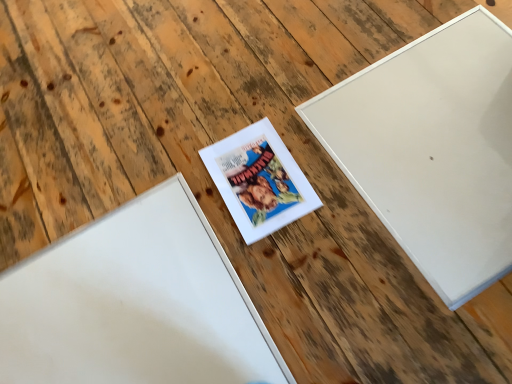
Locate an element on the screen. This screenshot has width=512, height=384. vacant space that is to the left of white matte picture frame at center, which is the second picture frame from left to right is located at coordinates (175, 212).